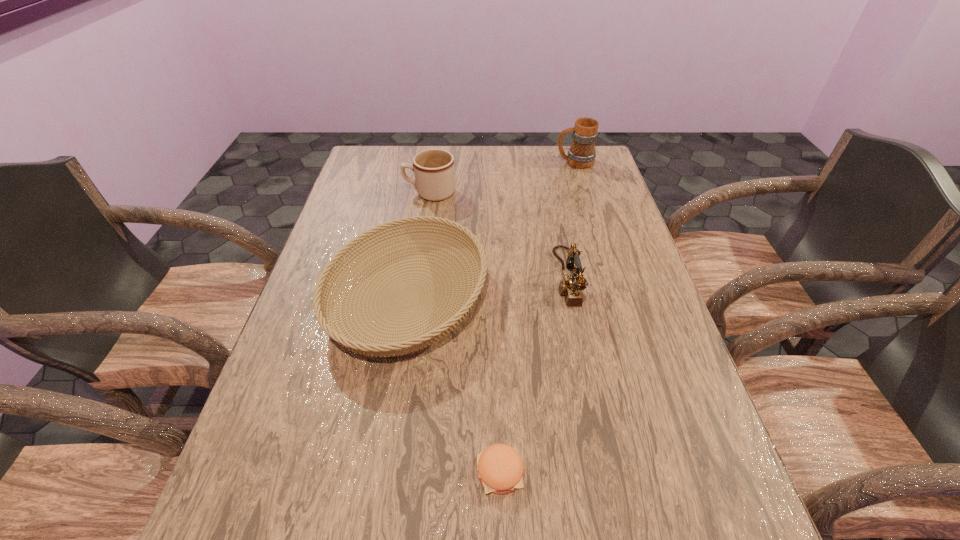
This screenshot has height=540, width=960. I want to click on free space between the basket and the farther mug, so click(492, 230).

Identify the location of free space between the fourth object from left to right and the basket. (487, 288).

Locate an element on the screen. vacant area that lies between the rightmost object and the nearest object is located at coordinates (538, 317).

Where is `vacant area that lies between the patty and the second farthest object`? The height and width of the screenshot is (540, 960). vacant area that lies between the patty and the second farthest object is located at coordinates (465, 333).

You are a GUI agent. You are given a task and a screenshot of the screen. Output one action in this format:
    pyautogui.click(x=<x>, y=<y>)
    Task: Click on the vacant area between the telephone and the fourth tallest object
    The image size is (960, 540).
    Given the screenshot: What is the action you would take?
    pyautogui.click(x=487, y=288)

I want to click on unoccupied area between the left mug and the nearest object, so click(465, 333).

This screenshot has height=540, width=960. Find the location of `free spot between the rightmost object and the telephone`. free spot between the rightmost object and the telephone is located at coordinates (570, 220).

Identify the location of the closest object to the second shortest object. This screenshot has height=540, width=960. (500, 468).

Locate an element on the screen. Image resolution: width=960 pixels, height=540 pixels. object that is the fourth closest one to the rightmost object is located at coordinates (500, 468).

Where is `vacant space that satisfies the following two spatial constraints: 1. on the side of the taller mug with the handle; 2. on the front side of the basket`? The image size is (960, 540). vacant space that satisfies the following two spatial constraints: 1. on the side of the taller mug with the handle; 2. on the front side of the basket is located at coordinates (616, 298).